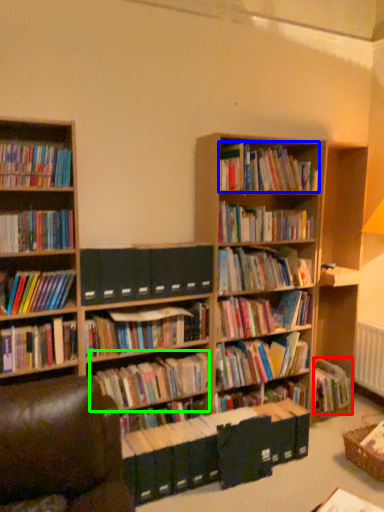
Question: Which is nearer to the book (highlighted by a red box)? book (highlighted by a blue box) or book (highlighted by a green box).

Choices:
 (A) book
 (B) book

Answer: (B)